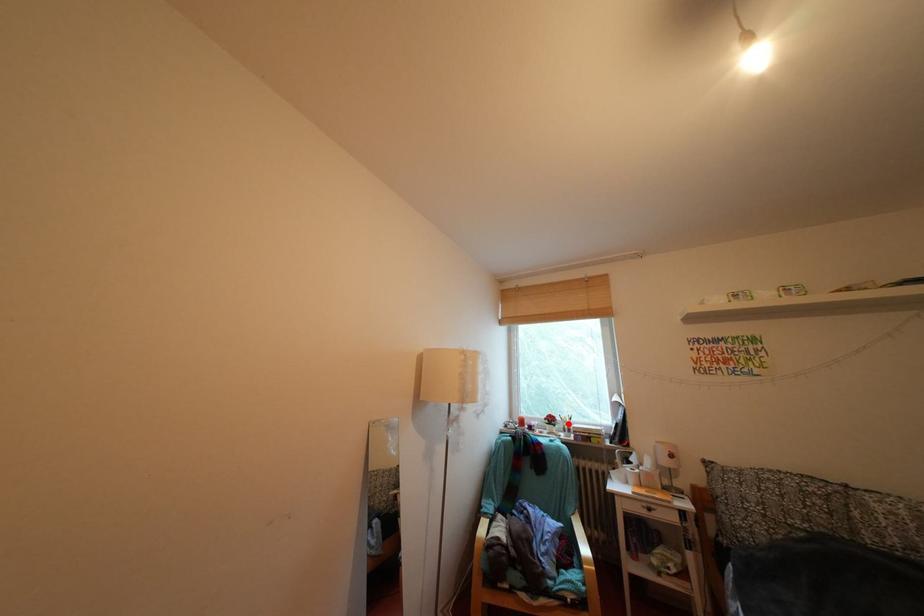
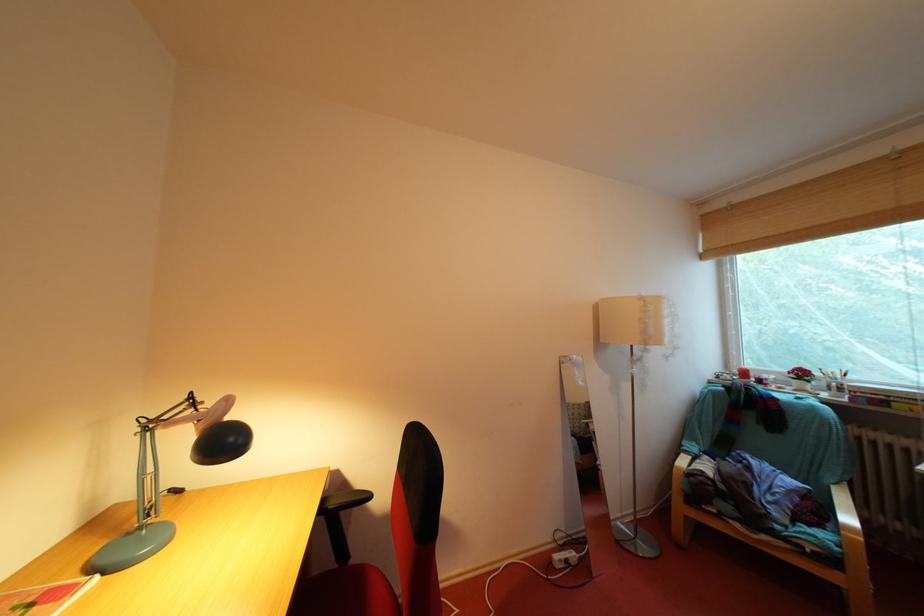
Locate, in the second image, the point that corresponds to the highlighted location in the first image.

(829, 379)